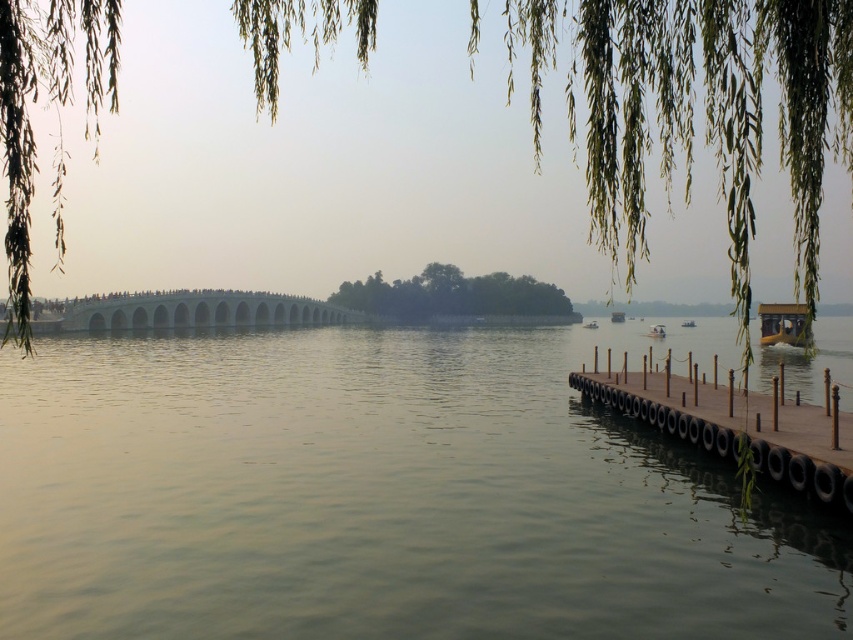
You are standing on the wooden dock and looking towards the arched bridge. There is a wooden boat at center and greenish water at center. Which one is closer to you?

The greenish water at center is below the wooden boat at center, so the wooden boat at center is closer to you.

You are standing at the camera position and want to take a photo of the green leafy willow at upper left. If your camera has a maximum focus range of 25 feet, will you be able to capture it clearly?

The green leafy willow at upper left is 26.59 feet from the camera, which exceeds the maximum focus range of 25 feet. Therefore, the camera cannot capture it clearly.